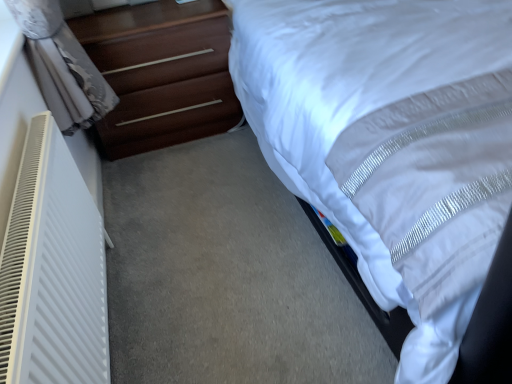
In order to click on blank space situated above white plastic radiator at left (from a real-world perspective) in this screenshot , I will do `click(22, 193)`.